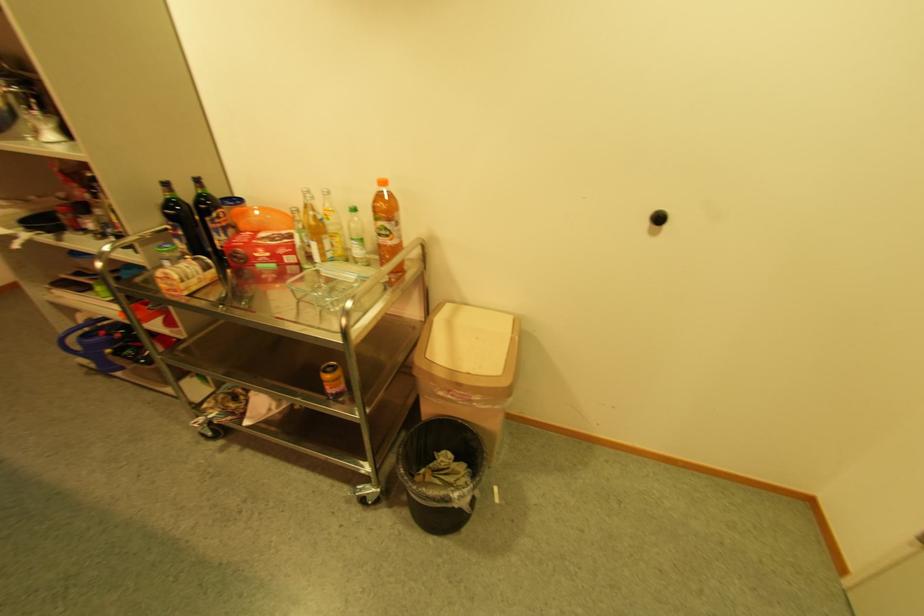
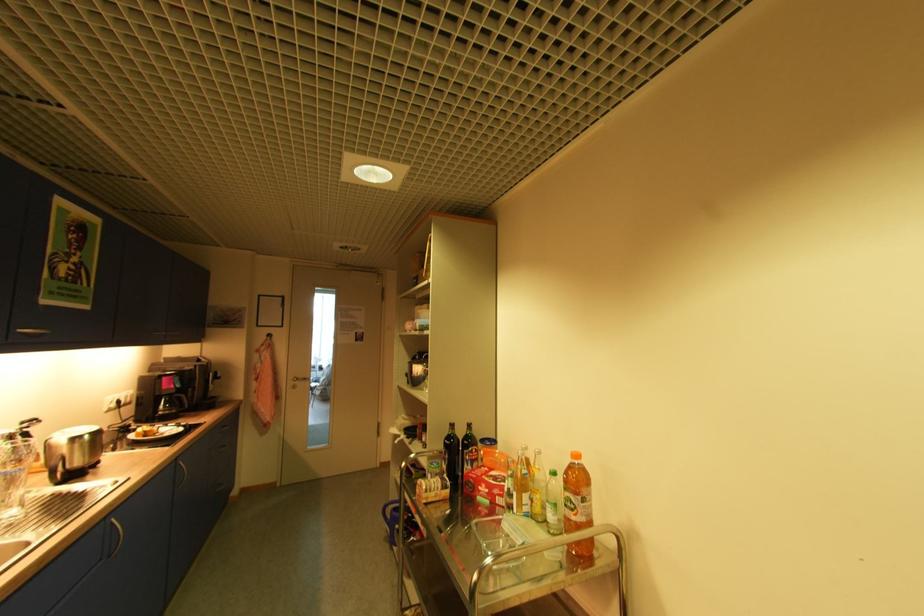
The point at (363,246) is marked in the first image. Where is the corresponding point in the second image?

(555, 511)